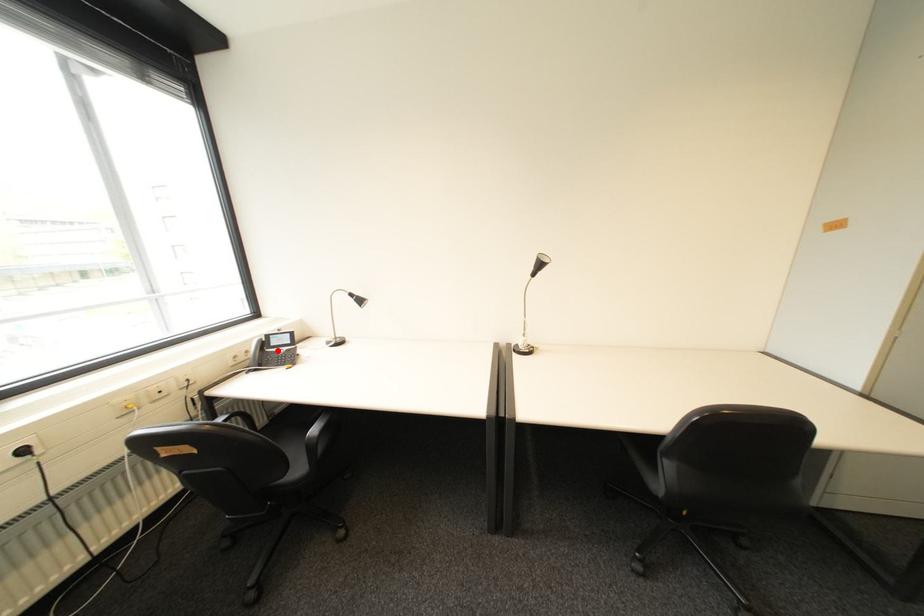
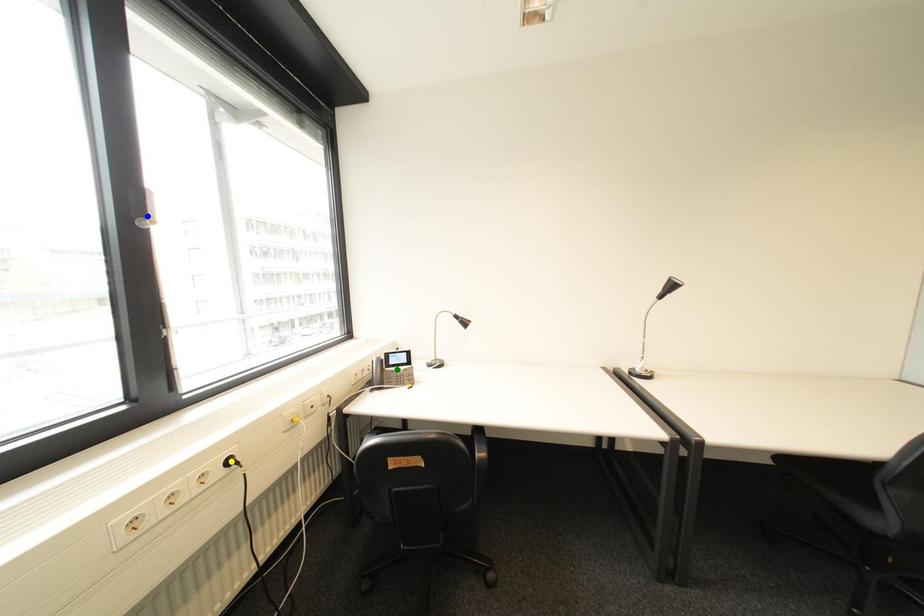
Question: I am providing you with two images of the same scene from different viewpoints. A red point is marked on the first image. You are given multiple points on the second image. Which mark in image 2 goes with the point in image 1?

Choices:
 (A) blue point
 (B) green point
 (C) yellow point

Answer: (B)